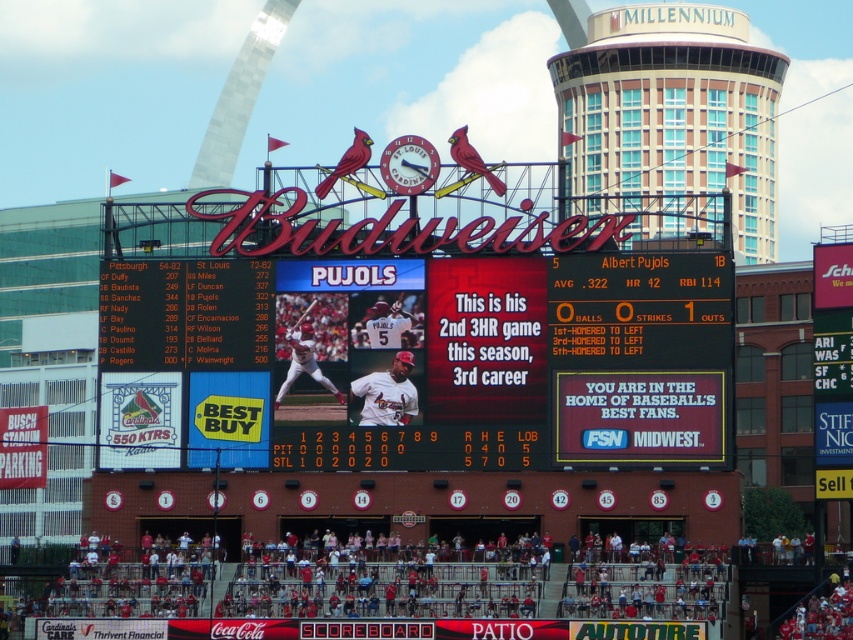
You are a photographer at Busch Stadium during the game. You want to take a photo of the white jersey baseball player at center without any obstructions. Is the matte black scoreboard at center blocking your view of the player?

The matte black scoreboard at center is positioned over white jersey baseball player at center, so it would block your view of the player.

You are a spectator at Busch Stadium and want to take a photo of the white jersey baseball player at center. However, you notice the matte black scoreboard at center might block your view. Based on the scene description, will the scoreboard be in front of or behind the player?

The matte black scoreboard at center is to the right of the white jersey baseball player at center, so it will be to the side of the player, not blocking the view directly. However, since both are at center, the scoreboard might still be in the background depending on the exact positioning.

You are a photographer at Busch Stadium and want to take a photo of the scoreboard. You have two points marked on your camera screen at coordinates point (x=640, y=355) and point (x=143, y=616). Which point is closer to the camera lens?

Point (x=143, y=616) is closer to the camera lens because the point (x=640, y=355) is behind it.